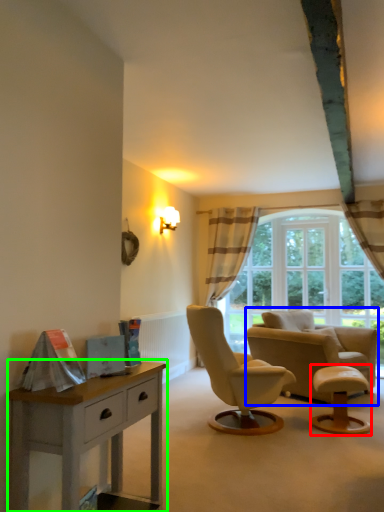
Question: Considering the real-world distances, which object is farthest from stool (highlighted by a red box)? chair (highlighted by a blue box) or nightstand (highlighted by a green box)?

Choices:
 (A) chair
 (B) nightstand

Answer: (B)